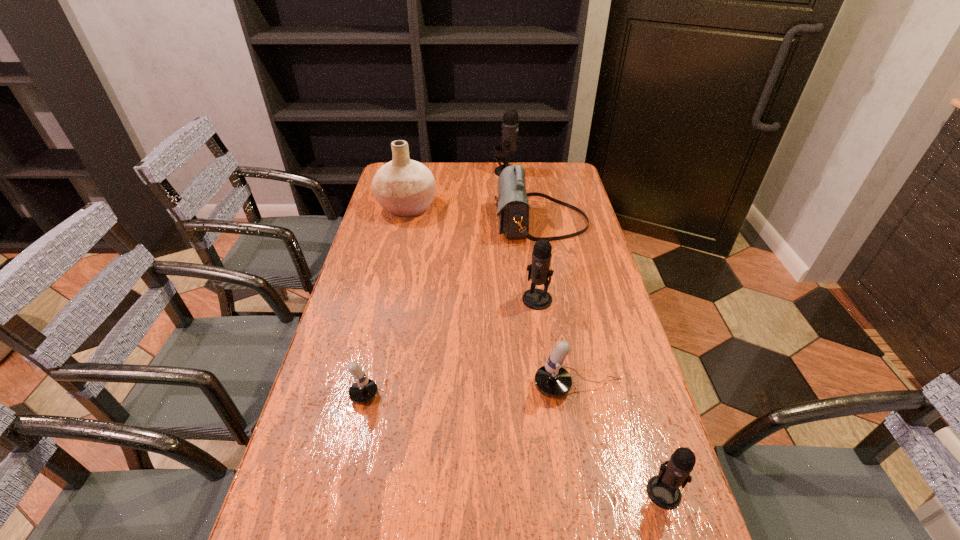
Locate an element on the screen. the shortest microphone is located at coordinates (364, 390).

The image size is (960, 540). I want to click on vacant area situated on the right of the tallest microphone, so click(x=546, y=172).

Locate an element on the screen. The height and width of the screenshot is (540, 960). free point located to pour from the handle of the pottery is located at coordinates (498, 208).

Where is `vacant area situated on the left of the fourth shortest microphone`? vacant area situated on the left of the fourth shortest microphone is located at coordinates (494, 299).

Locate an element on the screen. This screenshot has height=540, width=960. free space located on the back of the shoulder bag is located at coordinates (533, 178).

This screenshot has height=540, width=960. What are the coordinates of `free location located on the left of the bigger white microphone` in the screenshot? It's located at (429, 388).

This screenshot has height=540, width=960. I want to click on free location located 0.250m on the back of the rightmost black microphone, so click(628, 374).

Image resolution: width=960 pixels, height=540 pixels. Identify the location of vacant region located 0.280m on the back of the shortest microphone. (370, 303).

You are a GUI agent. You are given a task and a screenshot of the screen. Output one action in this format:
    pyautogui.click(x=<x>, y=<y>)
    Task: Click on the object that is at the far edge
    Image resolution: width=960 pixels, height=540 pixels.
    Given the screenshot: What is the action you would take?
    pyautogui.click(x=510, y=124)

This screenshot has height=540, width=960. I want to click on pottery that is positioned at the left edge, so click(x=405, y=188).